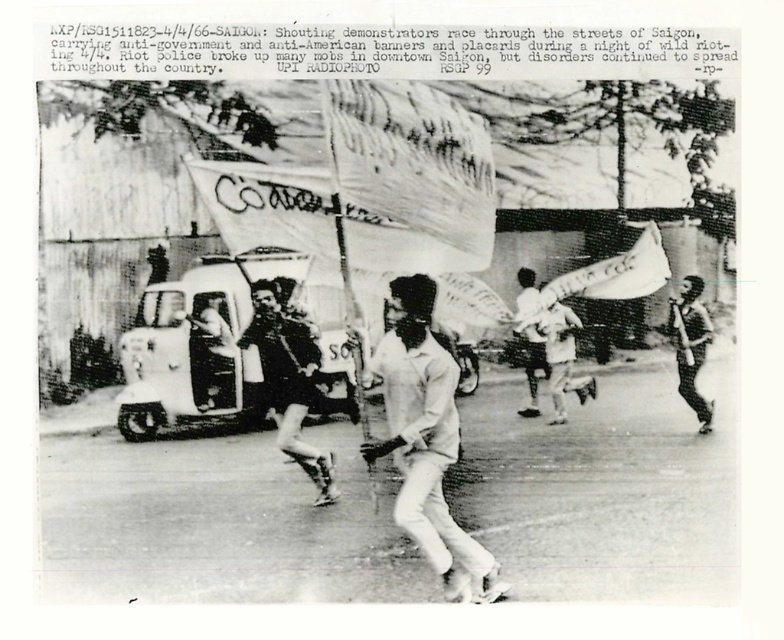
Can you confirm if white matte shirt at center is taller than dark skin human at right?

Correct, white matte shirt at center is much taller as dark skin human at right.

Who is higher up, white matte shirt at center or dark skin human at right?

dark skin human at right is higher up.

Describe the element at coordinates (426, 440) in the screenshot. This screenshot has width=784, height=640. I see `white matte shirt at center` at that location.

Where is `white matte shirt at center`? white matte shirt at center is located at coordinates (426, 440).

Between dark brown leather boots at center and dark skin human at right, which one appears on the right side from the viewer's perspective?

Positioned to the right is dark skin human at right.

Who is higher up, dark brown leather boots at center or dark skin human at right?

Positioned higher is dark skin human at right.

Locate an element on the screen. dark brown leather boots at center is located at coordinates (289, 380).

Can you confirm if white matte shirt at center is wider than dark brown leather boots at center?

Correct, the width of white matte shirt at center exceeds that of dark brown leather boots at center.

Who is more forward, (470, 572) or (294, 312)?

Point (470, 572) is more forward.

Does point (449, 577) come closer to viewer compared to point (296, 378)?

That is True.

This screenshot has height=640, width=784. Find the location of `white matte shirt at center`. white matte shirt at center is located at coordinates (426, 440).